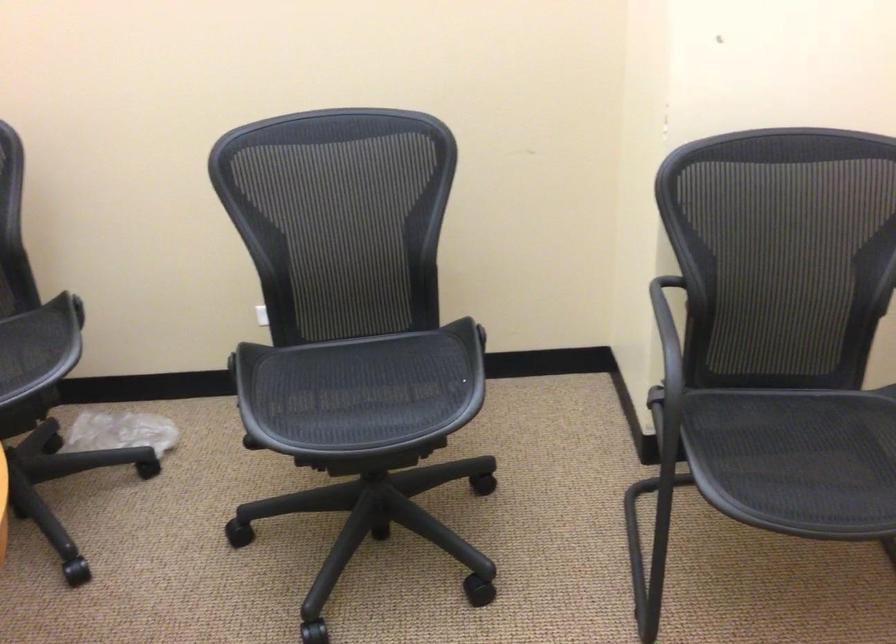
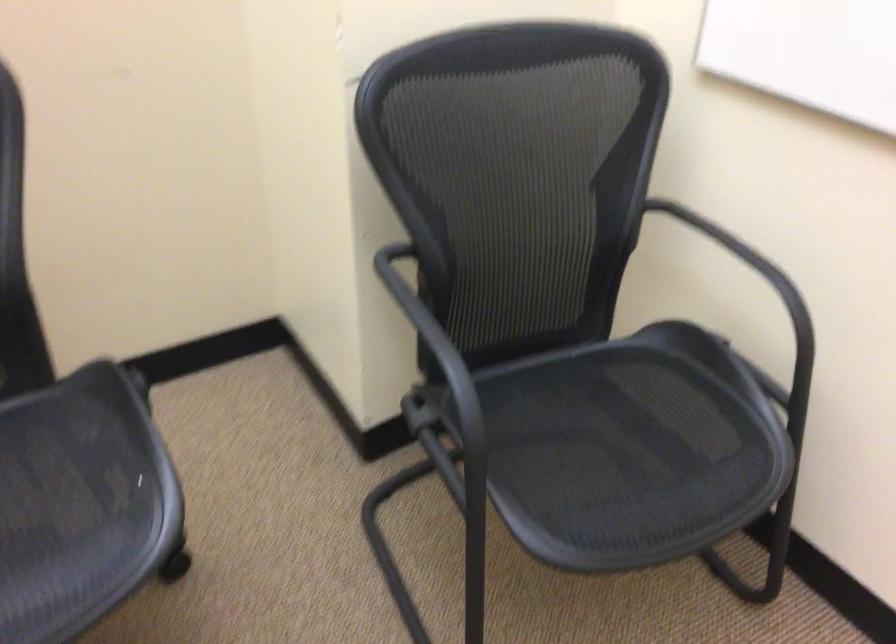
Question: The camera is either moving clockwise (left) or counter-clockwise (right) around the object. The first image is from the beginning of the video and the second image is from the end. Is the camera moving left or right when shooting the video?

Choices:
 (A) Left
 (B) Right

Answer: (A)